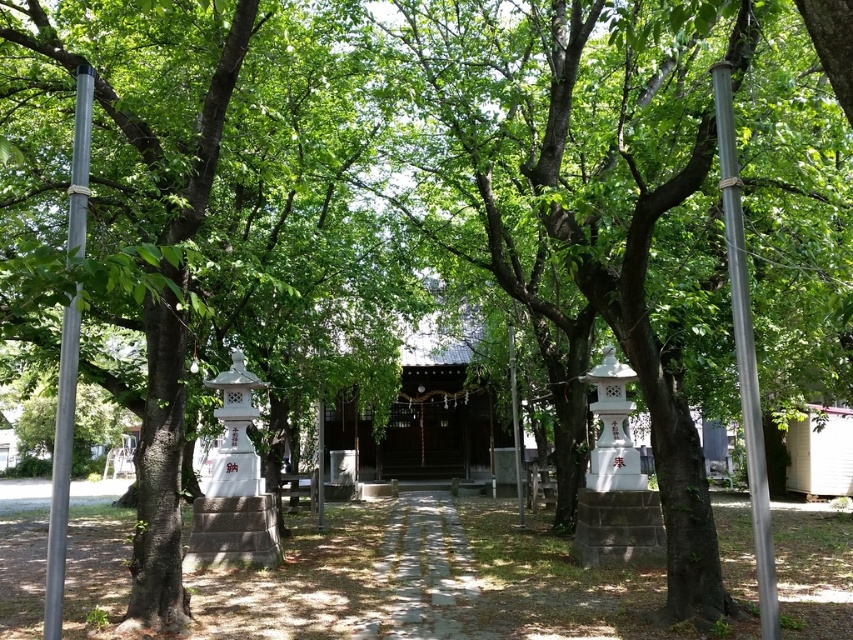
Which is in front, point (48, 545) or point (515, 474)?

Point (48, 545) is more forward.

Who is more distant from viewer, (62, 340) or (519, 508)?

Positioned behind is point (519, 508).

Between point (78, 224) and point (515, 432), which one is positioned behind?

The point (515, 432) is behind.

Image resolution: width=853 pixels, height=640 pixels. Find the location of `silver metallic pole at left`. silver metallic pole at left is located at coordinates (61, 468).

Does metallic gray pole at right appear over metallic pole at center?

Indeed, metallic gray pole at right is positioned over metallic pole at center.

The height and width of the screenshot is (640, 853). What are the coordinates of `metallic gray pole at right` in the screenshot? It's located at (746, 353).

Can you confirm if metallic gray pole at right is positioned to the left of silver metallic pole at left?

In fact, metallic gray pole at right is to the right of silver metallic pole at left.

Does point (737, 195) come behind point (51, 518)?

Yes.

In order to click on metallic gray pole at right in this screenshot , I will do `click(746, 353)`.